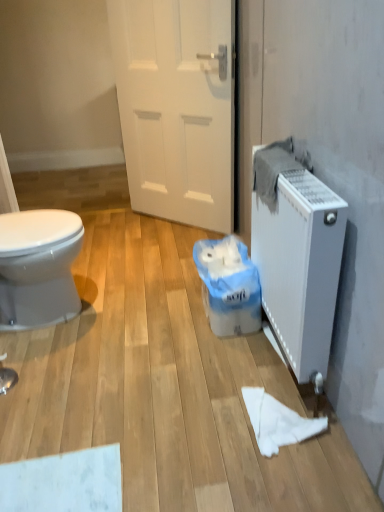
Where is `vacant area that is in front of white matte door at center`? vacant area that is in front of white matte door at center is located at coordinates (154, 254).